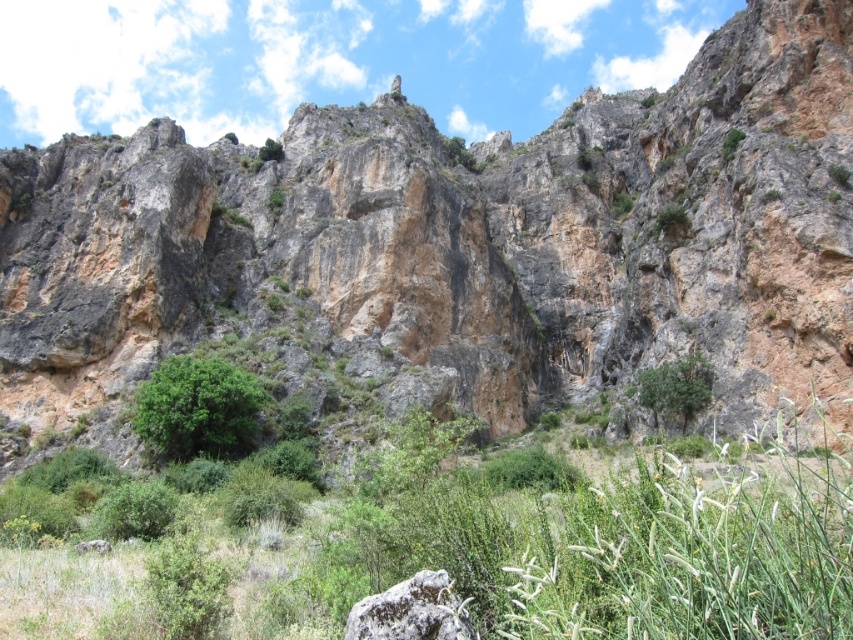
You are a hiker standing at the edge of the rugged landscape. You see a green leafy bush at center and a rough textured rock at center. Which object is closer to you?

The green leafy bush at center is closer to you because it is positioned further to the viewer than the rough textured rock at center.